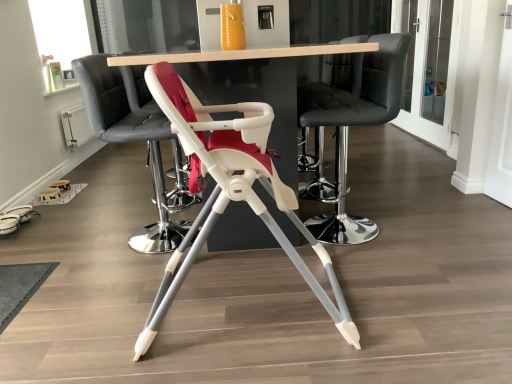
You are a GUI agent. You are given a task and a screenshot of the screen. Output one action in this format:
    pyautogui.click(x=<x>, y=<y>)
    Task: Click on the empty space that is to the right of black leather bar stool at center, the first chair from the back
    
    Given the screenshot: What is the action you would take?
    pyautogui.click(x=389, y=185)